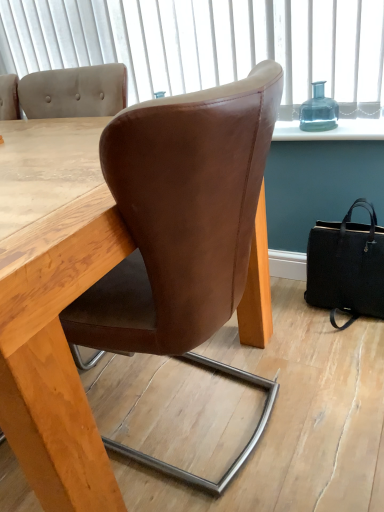
The height and width of the screenshot is (512, 384). What do you see at coordinates (319, 110) in the screenshot?
I see `transparent glass bottle at upper right` at bounding box center [319, 110].

The image size is (384, 512). In order to click on brown leather chair at center in this screenshot , I will do `click(182, 231)`.

Find the location of a particular element. This screenshot has height=512, width=384. black leather handbag at lower right is located at coordinates pos(347,266).

Between black leather handbag at lower right and transparent glass bottle at upper right, which one has more height?

Standing taller between the two is black leather handbag at lower right.

Does black leather handbag at lower right lie behind transparent glass bottle at upper right?

No, the depth of black leather handbag at lower right is less than that of transparent glass bottle at upper right.

From the picture: Considering the sizes of objects black leather handbag at lower right and transparent glass bottle at upper right in the image provided, who is wider, black leather handbag at lower right or transparent glass bottle at upper right?

Wider between the two is black leather handbag at lower right.

In the scene shown: From the image's perspective, is black leather handbag at lower right under transparent glass bottle at upper right?

Indeed, from the image's perspective, black leather handbag at lower right is shown beneath transparent glass bottle at upper right.

Does transparent glass bottle at upper right have a lesser width compared to brown leather chair at center?

Yes.

Is brown leather chair at center completely or partially inside transparent glass bottle at upper right?

No, brown leather chair at center is not a part of transparent glass bottle at upper right.

Does transparent glass bottle at upper right turn towards brown leather chair at center?

No, transparent glass bottle at upper right does not turn towards brown leather chair at center.

Considering the relative sizes of transparent glass bottle at upper right and brown leather chair at center in the image provided, is transparent glass bottle at upper right shorter than brown leather chair at center?

Yes.

Considering the relative sizes of brown leather chair at center and transparent glass bottle at upper right in the image provided, is brown leather chair at center wider than transparent glass bottle at upper right?

Yes, brown leather chair at center is wider than transparent glass bottle at upper right.

Is the position of brown leather chair at center more distant than that of transparent glass bottle at upper right?

No, it is in front of transparent glass bottle at upper right.

Between point (126, 342) and point (309, 119), which one is positioned behind?

The point (309, 119) is farther.

Can you confirm if brown leather chair at center is taller than transparent glass bottle at upper right?

Yes.

Is transparent glass bottle at upper right looking in the opposite direction of black leather handbag at lower right?

transparent glass bottle at upper right does not have its back to black leather handbag at lower right.

Is transparent glass bottle at upper right positioned beyond the bounds of black leather handbag at lower right?

Indeed, transparent glass bottle at upper right is completely outside black leather handbag at lower right.

From a real-world perspective, who is located higher, transparent glass bottle at upper right or black leather handbag at lower right?

In real-world perspective, transparent glass bottle at upper right is above.

From the image's perspective, would you say transparent glass bottle at upper right is positioned over black leather handbag at lower right?

Yes.

Looking at this image, does brown leather chair at center have a greater height compared to black leather handbag at lower right?

Correct, brown leather chair at center is much taller as black leather handbag at lower right.

Where is `chair above the black leather handbag at lower right (from a real-world perspective)`? chair above the black leather handbag at lower right (from a real-world perspective) is located at coordinates (182, 231).

Is point (140, 247) closer or farther from the camera than point (361, 248)?

Point (140, 247) is positioned closer to the camera compared to point (361, 248).

Does black leather handbag at lower right have a smaller size compared to brown leather chair at center?

Indeed, black leather handbag at lower right has a smaller size compared to brown leather chair at center.

Is the depth of black leather handbag at lower right less than that of brown leather chair at center?

That is False.

From the image's perspective, is black leather handbag at lower right positioned above or below brown leather chair at center?

Based on their image positions, black leather handbag at lower right is located above brown leather chair at center.

Between black leather handbag at lower right and brown leather chair at center, which one appears on the right side from the viewer's perspective?

Positioned to the right is black leather handbag at lower right.

Identify the location of handbag that appears below the transparent glass bottle at upper right (from a real-world perspective). Image resolution: width=384 pixels, height=512 pixels. (347, 266).

Identify the location of chair below the transparent glass bottle at upper right (from the image's perspective). (182, 231).

Based on their spatial positions, is brown leather chair at center or black leather handbag at lower right further from transparent glass bottle at upper right?

Based on the image, brown leather chair at center appears to be further to transparent glass bottle at upper right.

When comparing their distances from black leather handbag at lower right, does brown leather chair at center or transparent glass bottle at upper right seem closer?

transparent glass bottle at upper right is positioned closer to the anchor black leather handbag at lower right.

From the image, which object appears to be nearer to transparent glass bottle at upper right, black leather handbag at lower right or brown leather chair at center?

black leather handbag at lower right is positioned closer to the anchor transparent glass bottle at upper right.

Looking at the image, which one is located closer to brown leather chair at center, transparent glass bottle at upper right or black leather handbag at lower right?

black leather handbag at lower right is positioned closer to the anchor brown leather chair at center.

Which object lies nearer to the anchor point brown leather chair at center, black leather handbag at lower right or transparent glass bottle at upper right?

black leather handbag at lower right is closer to brown leather chair at center.

From the image, which object appears to be farther from black leather handbag at lower right, transparent glass bottle at upper right or brown leather chair at center?

brown leather chair at center lies further to black leather handbag at lower right than the other object.

Image resolution: width=384 pixels, height=512 pixels. In order to click on bottle between brown leather chair at center and black leather handbag at lower right from left to right in this screenshot , I will do `click(319, 110)`.